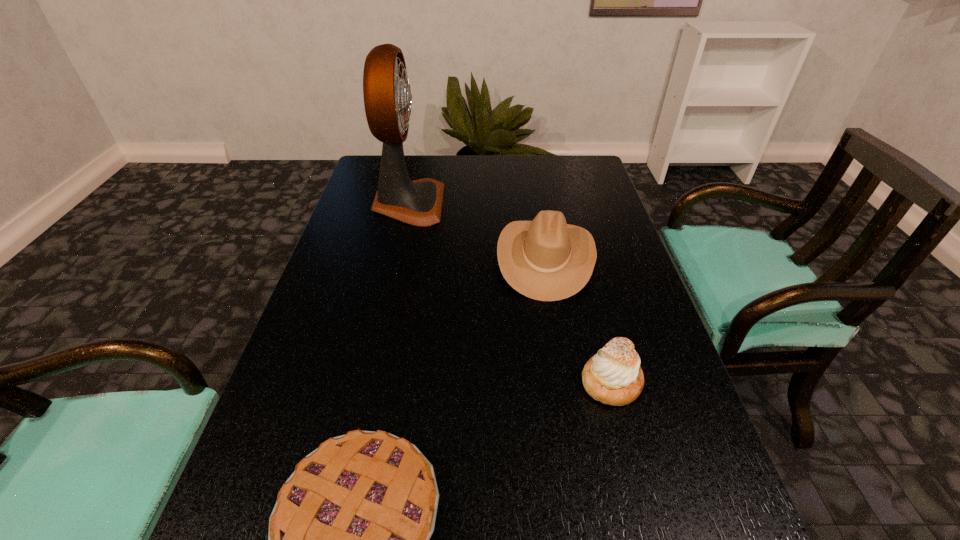
Find the location of a particular element. object present at the far left corner is located at coordinates (387, 95).

You are a GUI agent. You are given a task and a screenshot of the screen. Output one action in this format:
    pyautogui.click(x=<x>, y=<y>)
    Task: Click on the vacant space at the far edge of the desktop
    The image size is (960, 540).
    Given the screenshot: What is the action you would take?
    pyautogui.click(x=544, y=187)

In order to click on free space at the left edge in this screenshot , I will do `click(294, 401)`.

The height and width of the screenshot is (540, 960). Identify the location of vacant space at the right edge. (x=637, y=404).

The width and height of the screenshot is (960, 540). Find the location of `free space at the far right corner of the desktop`. free space at the far right corner of the desktop is located at coordinates (579, 163).

At what (x,y) coordinates should I click in order to perform the action: click on vacant area that lies between the pastry and the cowboy hat. Please return your answer as a coordinate pair (x, y). The width and height of the screenshot is (960, 540). Looking at the image, I should click on (578, 320).

The width and height of the screenshot is (960, 540). What are the coordinates of `vacant area that lies between the cowboy hat and the tallest object` in the screenshot? It's located at (477, 231).

You are a GUI agent. You are given a task and a screenshot of the screen. Output one action in this format:
    pyautogui.click(x=<x>, y=<y>)
    Task: Click on the vacant area between the cowboy hat and the fan
    
    Given the screenshot: What is the action you would take?
    pyautogui.click(x=477, y=231)

You are a GUI agent. You are given a task and a screenshot of the screen. Output one action in this format:
    pyautogui.click(x=<x>, y=<y>)
    Task: Click on the free space between the cowboy hat and the third farthest object
    This screenshot has height=540, width=960.
    Given the screenshot: What is the action you would take?
    pyautogui.click(x=578, y=320)

The height and width of the screenshot is (540, 960). What are the coordinates of `vacant space in between the tallest object and the cowboy hat` in the screenshot? It's located at (477, 231).